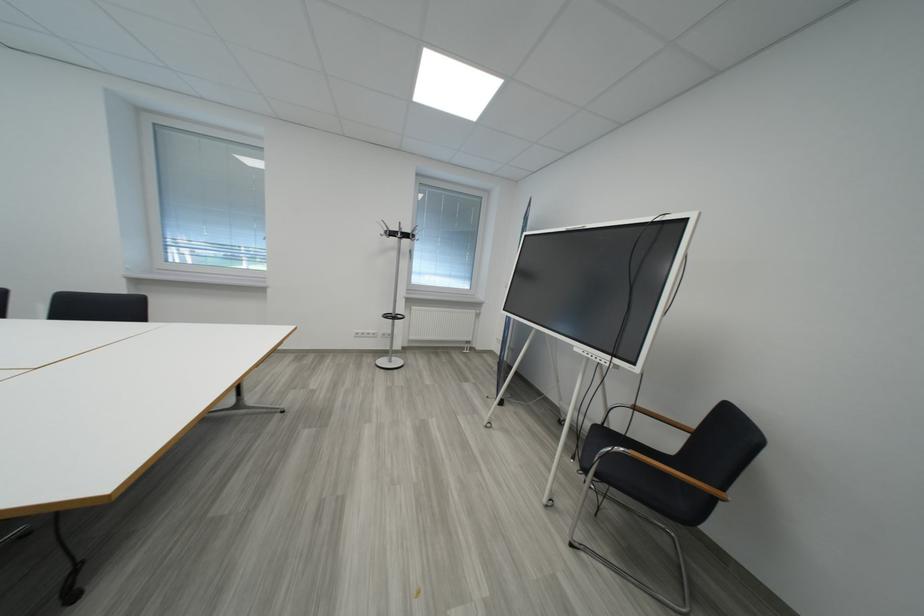
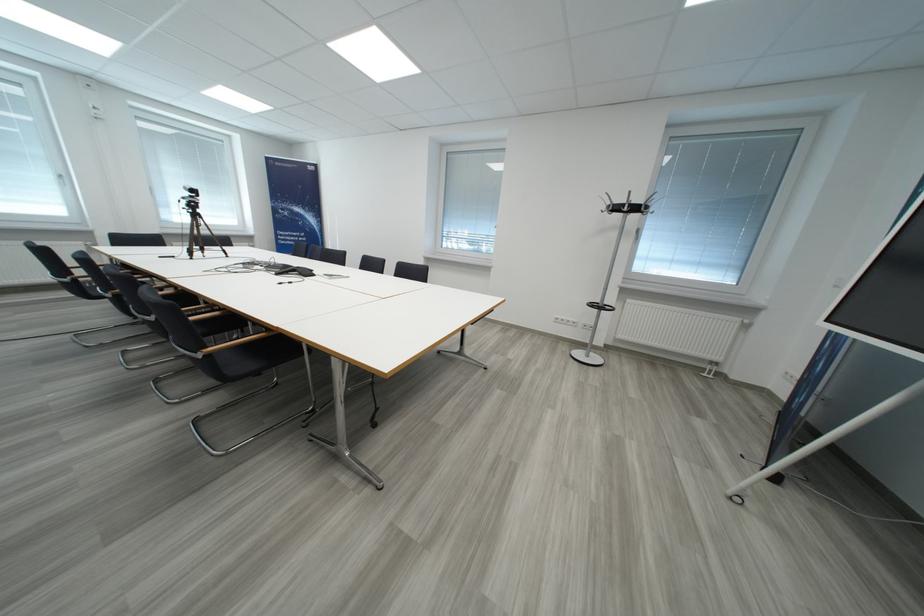
Question: The camera is either moving clockwise (left) or counter-clockwise (right) around the object. The first image is from the beginning of the video and the second image is from the end. Is the camera moving left or right when shooting the video?

Choices:
 (A) Left
 (B) Right

Answer: (B)